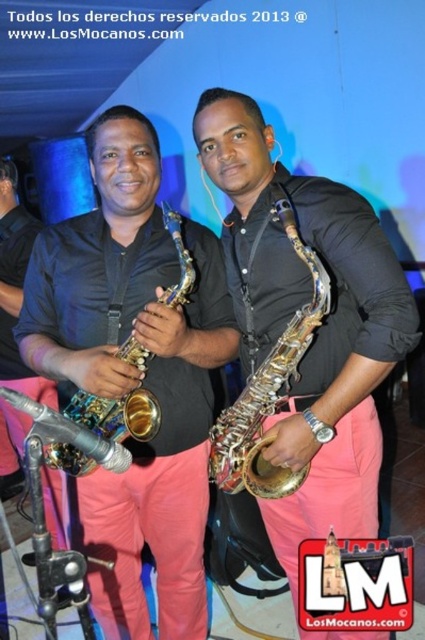
Question: Among these objects, which one is farthest from the camera?

Choices:
 (A) metallic saxophone at center
 (B) satin gold saxophone at center
 (C) brushed metal saxophone at center
 (D) gold metallic saxophone at center

Answer: (A)

Question: Is the position of metallic saxophone at center less distant than that of gold metallic saxophone at center?

Choices:
 (A) no
 (B) yes

Answer: (A)

Question: Considering the relative positions of satin gold saxophone at center and gold metallic saxophone at center in the image provided, where is satin gold saxophone at center located with respect to gold metallic saxophone at center?

Choices:
 (A) right
 (B) left

Answer: (A)

Question: Is satin gold saxophone at center positioned at the back of gold metallic saxophone at center?

Choices:
 (A) no
 (B) yes

Answer: (A)

Question: Which point is closer to the camera?

Choices:
 (A) (289, 368)
 (B) (190, 419)
 (C) (359, 280)
 (D) (79, 449)

Answer: (C)

Question: Which of the following is the closest to the observer?

Choices:
 (A) brushed metal saxophone at center
 (B) metallic saxophone at center
 (C) satin gold saxophone at center

Answer: (A)